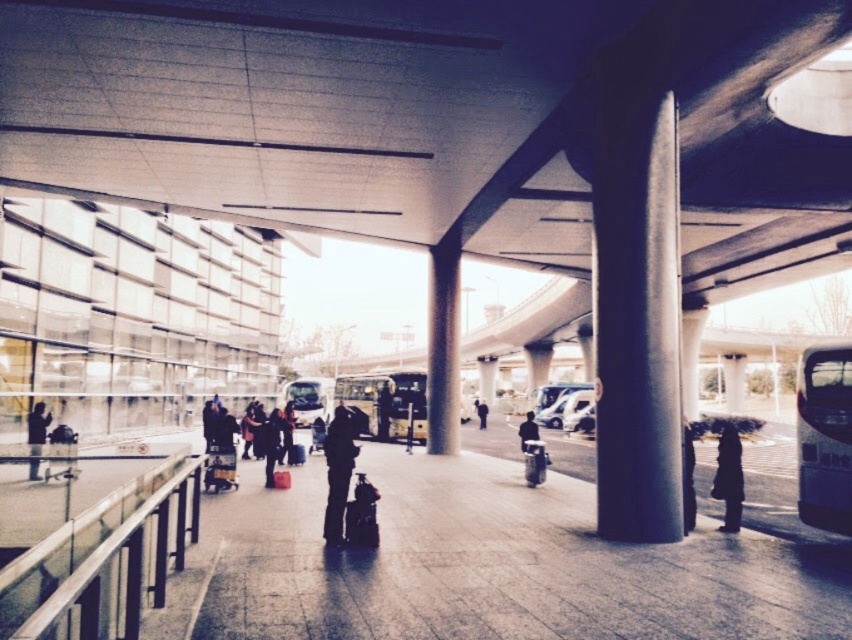
Question: Is metallic silver bus at right further to camera compared to dark blue jacket at center?

Choices:
 (A) yes
 (B) no

Answer: (B)

Question: Is dark blue fabric coat at lower right behind dark gray suit at center?

Choices:
 (A) no
 (B) yes

Answer: (A)

Question: Does dark blue jacket at center have a smaller size compared to dark gray suit at center?

Choices:
 (A) yes
 (B) no

Answer: (B)

Question: Which object appears closest to the camera in this image?

Choices:
 (A) matte black suitcase at center
 (B) white glossy bus at center
 (C) dark gray suit at center
 (D) dark brown leather jacket at center

Answer: (A)

Question: Which object appears closest to the camera in this image?

Choices:
 (A) satin silver pole at right
 (B) dark blue jacket at center

Answer: (A)

Question: Among these points, which one is farthest from the camera?

Choices:
 (A) (344, 465)
 (B) (39, 451)
 (C) (481, 426)

Answer: (C)